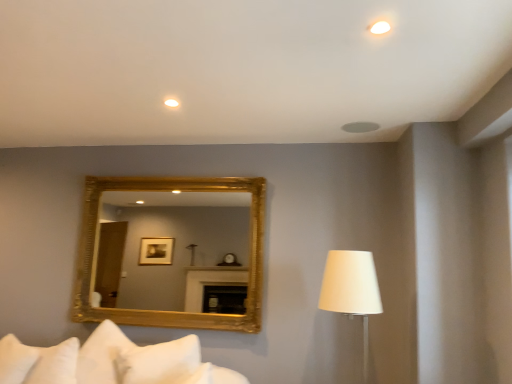
Question: Is white matte ceiling light at upper center, arranged as the 2th lighting when ordered from the bottom, aimed at white fabric lampshade at right?

Choices:
 (A) no
 (B) yes

Answer: (A)

Question: Considering the relative positions of white matte ceiling light at upper center, which is the second lighting from back to front, and white fabric lampshade at right in the image provided, is white matte ceiling light at upper center, which is the second lighting from back to front, in front of white fabric lampshade at right?

Choices:
 (A) no
 (B) yes

Answer: (B)

Question: From a real-world perspective, is white matte ceiling light at upper center, which is the second lighting from back to front, positioned under white fabric lampshade at right based on gravity?

Choices:
 (A) no
 (B) yes

Answer: (A)

Question: From a real-world perspective, is white matte ceiling light at upper center, the first lighting when ordered from right to left, physically above white fabric lampshade at right?

Choices:
 (A) no
 (B) yes

Answer: (B)

Question: Does white matte ceiling light at upper center, the first lighting from the front, have a larger size compared to white fabric lampshade at right?

Choices:
 (A) no
 (B) yes

Answer: (A)

Question: Considering the relative sizes of white matte ceiling light at upper center, the 2th lighting when ordered from left to right, and white fabric lampshade at right in the image provided, is white matte ceiling light at upper center, the 2th lighting when ordered from left to right, wider than white fabric lampshade at right?

Choices:
 (A) yes
 (B) no

Answer: (B)

Question: Is gold/gilded mirror at center touching white soft pillow at lower left, which ranks as the second pillow in right-to-left order?

Choices:
 (A) no
 (B) yes

Answer: (A)

Question: Is gold/gilded mirror at center not within white soft pillow at lower left, which ranks as the second pillow in right-to-left order?

Choices:
 (A) no
 (B) yes

Answer: (B)

Question: From a real-world perspective, does gold/gilded mirror at center sit lower than white soft pillow at lower left, which ranks as the second pillow in right-to-left order?

Choices:
 (A) yes
 (B) no

Answer: (B)

Question: Can you confirm if gold/gilded mirror at center is wider than white soft pillow at lower left, which is counted as the 1th pillow, starting from the left?

Choices:
 (A) no
 (B) yes

Answer: (A)

Question: Are gold/gilded mirror at center and white soft pillow at lower left, which is counted as the 1th pillow, starting from the left, far apart?

Choices:
 (A) yes
 (B) no

Answer: (A)

Question: Is gold/gilded mirror at center in front of white soft pillow at lower left, which ranks as the second pillow in right-to-left order?

Choices:
 (A) yes
 (B) no

Answer: (B)

Question: Is white soft pillow at lower left, which appears as the 2th pillow when viewed from the left, shorter than white matte ceiling light at upper center, the second lighting positioned from the front?

Choices:
 (A) no
 (B) yes

Answer: (A)